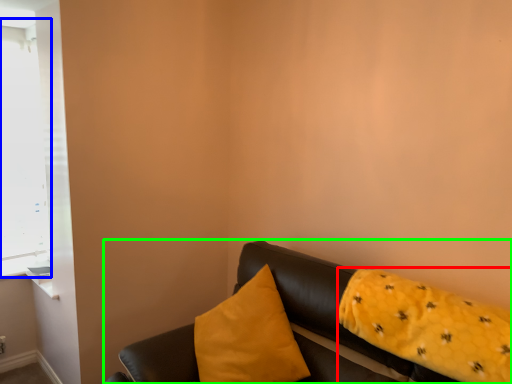
Question: Which object is positioned closest to pillow (highlighted by a red box)? Select from window (highlighted by a blue box) and studio couch (highlighted by a green box).

Choices:
 (A) window
 (B) studio couch

Answer: (B)